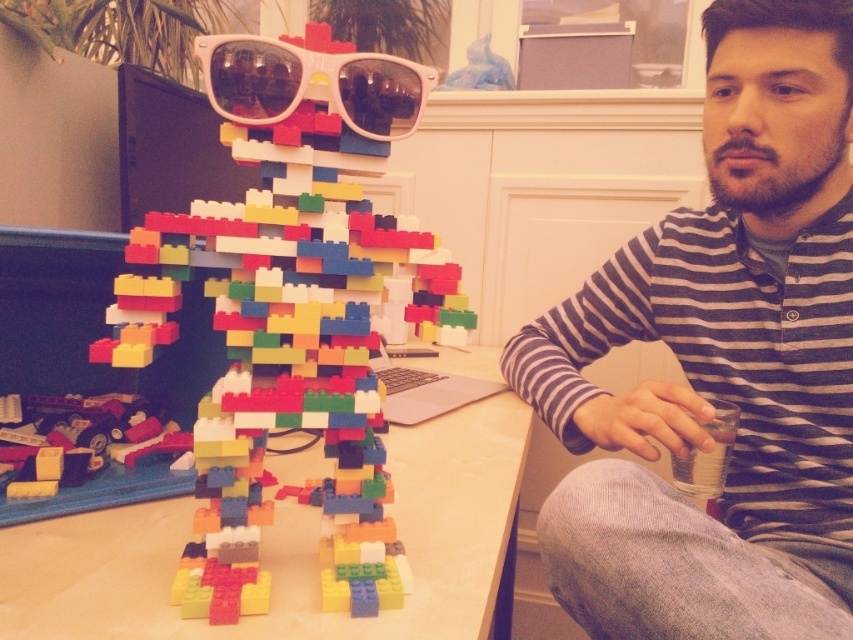
You are standing at the viewpoint of the person sitting at the desk. You want to reach both the point at (436, 451) and the point at (370, 92). Which point should you reach for first to avoid blocking your view of the other point?

You should reach for point (370, 92) first because point (436, 451) is behind it. Reaching for the closer point first will prevent blocking your view of the point behind.

You are an architect designing a small model house. You need to place a window at the point with coordinates point (293, 296). What object is located at that point in the image?

The point (293, 296) corresponds to the multicolored plastic blocks at center, so the window should be placed there.